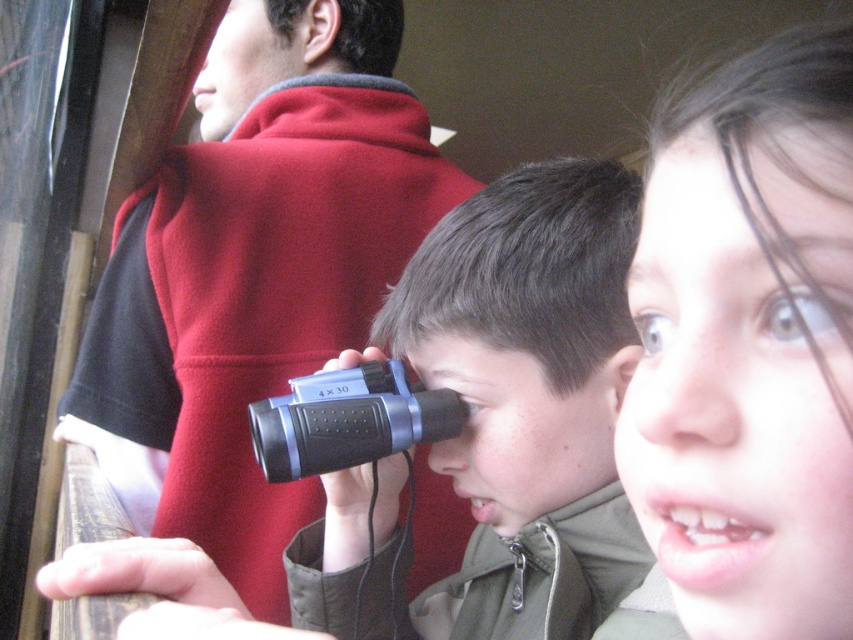
You are a photographer trying to capture a group photo of the red fleece jacket at upper center and the smooth skin face at upper right. Since you want to ensure both are in focus, you need to know their distance apart. Can you determine if they are close enough for the camera to focus on both?

The red fleece jacket at upper center is positioned on the left side of smooth skin face at upper right, so they are close enough to be in focus together.